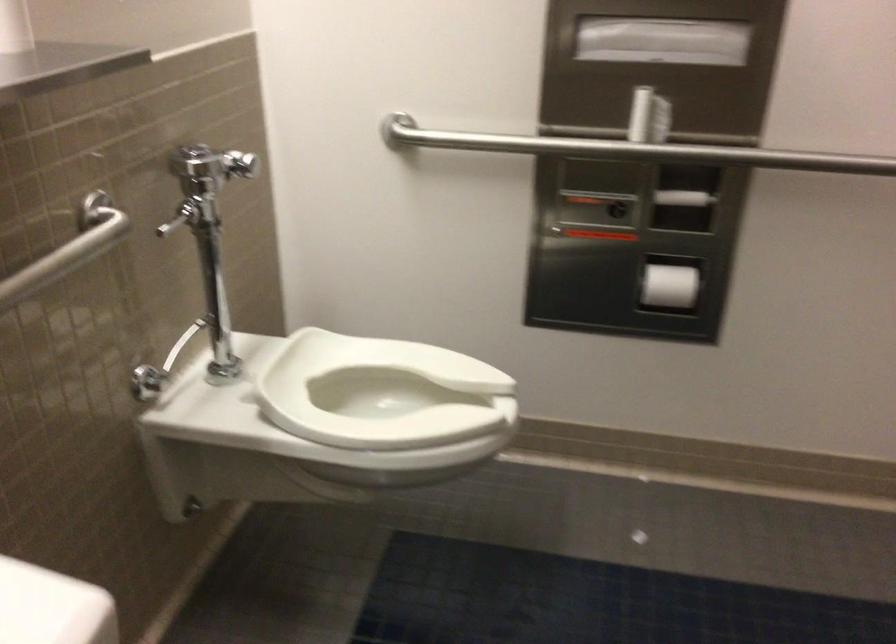
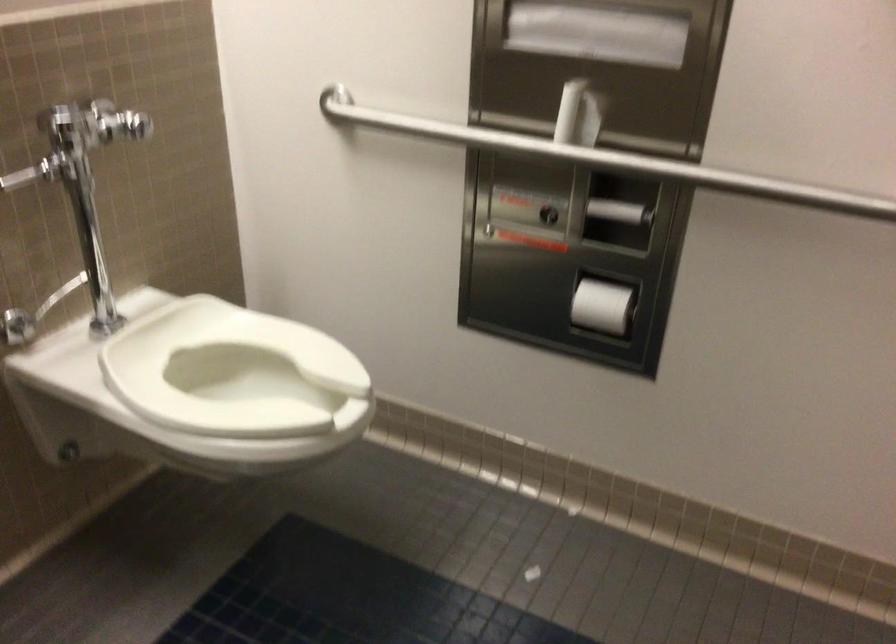
Question: How did the camera likely rotate?

Choices:
 (A) Left
 (B) Right
 (C) Up
 (D) Down

Answer: (A)